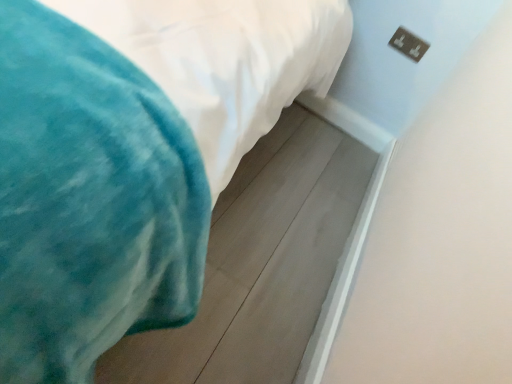
This screenshot has width=512, height=384. Describe the element at coordinates (408, 44) in the screenshot. I see `metallic silver outlet at upper right` at that location.

The width and height of the screenshot is (512, 384). Identify the location of metallic silver outlet at upper right. (408, 44).

This screenshot has width=512, height=384. Describe the element at coordinates (131, 157) in the screenshot. I see `velvet teal blanket at lower left` at that location.

I want to click on velvet teal blanket at lower left, so (131, 157).

What are the coordinates of `metallic silver outlet at upper right` in the screenshot? It's located at (408, 44).

Considering the relative positions of metallic silver outlet at upper right and velvet teal blanket at lower left in the image provided, is metallic silver outlet at upper right to the right of velvet teal blanket at lower left from the viewer's perspective?

Yes.

Is the position of metallic silver outlet at upper right less distant than that of velvet teal blanket at lower left?

No, it is behind velvet teal blanket at lower left.

Considering the points (423, 44) and (105, 173), which point is in front, point (423, 44) or point (105, 173)?

Point (105, 173)

From the image's perspective, which one is positioned lower, metallic silver outlet at upper right or velvet teal blanket at lower left?

velvet teal blanket at lower left appears lower in the image.

From a real-world perspective, is metallic silver outlet at upper right on velvet teal blanket at lower left?

Yes, from a real-world perspective, metallic silver outlet at upper right is above velvet teal blanket at lower left.

Can you confirm if metallic silver outlet at upper right is wider than velvet teal blanket at lower left?

No.

From their relative heights in the image, would you say metallic silver outlet at upper right is taller or shorter than velvet teal blanket at lower left?

In the image, metallic silver outlet at upper right appears to be taller than velvet teal blanket at lower left.

Does metallic silver outlet at upper right have a larger size compared to velvet teal blanket at lower left?

Actually, metallic silver outlet at upper right might be smaller than velvet teal blanket at lower left.

Is metallic silver outlet at upper right not inside velvet teal blanket at lower left?

metallic silver outlet at upper right lies outside velvet teal blanket at lower left's area.

Consider the image. Is metallic silver outlet at upper right not near velvet teal blanket at lower left?

metallic silver outlet at upper right is far away from velvet teal blanket at lower left.

Is metallic silver outlet at upper right positioned with its back to velvet teal blanket at lower left?

metallic silver outlet at upper right does not have its back to velvet teal blanket at lower left.

Measure the distance from metallic silver outlet at upper right to velvet teal blanket at lower left.

They are 4.29 feet apart.

The height and width of the screenshot is (384, 512). Find the location of `bed on the left of metallic silver outlet at upper right`. bed on the left of metallic silver outlet at upper right is located at coordinates (131, 157).

Is velvet teal blanket at lower left to the right of metallic silver outlet at upper right from the viewer's perspective?

No.

Which object is more forward, velvet teal blanket at lower left or metallic silver outlet at upper right?

velvet teal blanket at lower left is in front.

Which point is more distant from viewer, (x=179, y=76) or (x=401, y=35)?

The point (x=401, y=35) is farther.

In the scene shown: From the image's perspective, between velvet teal blanket at lower left and metallic silver outlet at upper right, who is located below?

velvet teal blanket at lower left.

From a real-world perspective, does velvet teal blanket at lower left sit lower than metallic silver outlet at upper right?

Yes.

Is velvet teal blanket at lower left wider or thinner than metallic silver outlet at upper right?

velvet teal blanket at lower left is wider than metallic silver outlet at upper right.

Is velvet teal blanket at lower left taller or shorter than metallic silver outlet at upper right?

velvet teal blanket at lower left is shorter than metallic silver outlet at upper right.

Considering the relative sizes of velvet teal blanket at lower left and metallic silver outlet at upper right in the image provided, is velvet teal blanket at lower left bigger than metallic silver outlet at upper right?

Yes.

Would you say velvet teal blanket at lower left is outside metallic silver outlet at upper right?

Yes.

Would you say velvet teal blanket at lower left is a long distance from metallic silver outlet at upper right?

Yes, velvet teal blanket at lower left is far from metallic silver outlet at upper right.

Could you tell me if velvet teal blanket at lower left is turned towards metallic silver outlet at upper right?

No, velvet teal blanket at lower left is not aimed at metallic silver outlet at upper right.

What's the angular difference between velvet teal blanket at lower left and metallic silver outlet at upper right's facing directions?

The angle between the facing direction of velvet teal blanket at lower left and the facing direction of metallic silver outlet at upper right is 180 degrees.

Where is `electric outlet on the right of velvet teal blanket at lower left`? This screenshot has width=512, height=384. electric outlet on the right of velvet teal blanket at lower left is located at coordinates (408, 44).

Where is `electric outlet above the velvet teal blanket at lower left (from a real-world perspective)`? This screenshot has height=384, width=512. electric outlet above the velvet teal blanket at lower left (from a real-world perspective) is located at coordinates (408, 44).

Where is `bed that appears on the left of metallic silver outlet at upper right`? Image resolution: width=512 pixels, height=384 pixels. bed that appears on the left of metallic silver outlet at upper right is located at coordinates (131, 157).